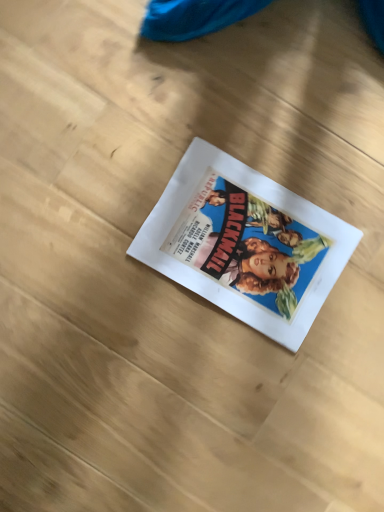
Find the location of a particular element. This screenshot has width=384, height=512. vacant region above white paper book at center (from a real-world perspective) is located at coordinates (247, 244).